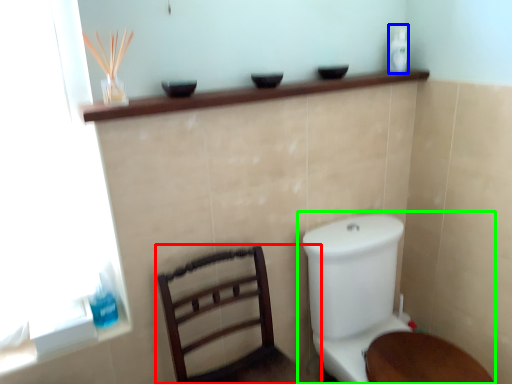
Question: Which object is positioned farthest from furniture (highlighted by a red box)? Select from toiletry (highlighted by a blue box) and toilet (highlighted by a green box).

Choices:
 (A) toiletry
 (B) toilet

Answer: (A)